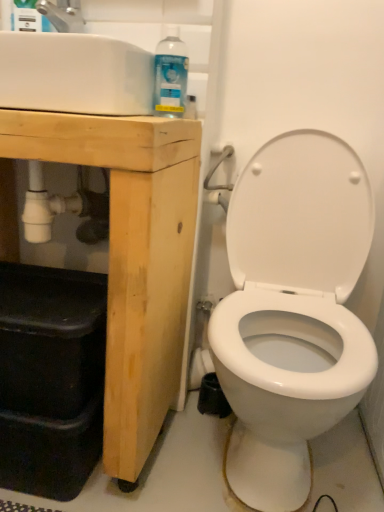
Question: Is natural wood cabinet at left shorter than clear plastic spray bottle at upper left, which appears as the 2th cleaning product when viewed from the right?

Choices:
 (A) no
 (B) yes

Answer: (A)

Question: Does natural wood cabinet at left come behind clear plastic spray bottle at upper left, which ranks as the first cleaning product in top-to-bottom order?

Choices:
 (A) no
 (B) yes

Answer: (A)

Question: Considering the relative sizes of natural wood cabinet at left and clear plastic spray bottle at upper left, the first cleaning product positioned from the left, in the image provided, is natural wood cabinet at left thinner than clear plastic spray bottle at upper left, the first cleaning product positioned from the left,?

Choices:
 (A) no
 (B) yes

Answer: (A)

Question: Considering the relative sizes of natural wood cabinet at left and clear plastic spray bottle at upper left, which appears as the 2th cleaning product when viewed from the right, in the image provided, is natural wood cabinet at left taller than clear plastic spray bottle at upper left, which appears as the 2th cleaning product when viewed from the right,?

Choices:
 (A) yes
 (B) no

Answer: (A)

Question: Can you confirm if natural wood cabinet at left is wider than clear plastic spray bottle at upper left, which ranks as the first cleaning product in top-to-bottom order?

Choices:
 (A) yes
 (B) no

Answer: (A)

Question: From the image's perspective, is natural wood cabinet at left above clear plastic spray bottle at upper left, the first cleaning product positioned from the left?

Choices:
 (A) yes
 (B) no

Answer: (B)

Question: From the image's perspective, would you say clear plastic spray bottle at upper left, the first cleaning product positioned from the left, is shown under clear plastic spray bottle at upper left, positioned as the 2th cleaning product in left-to-right order?

Choices:
 (A) yes
 (B) no

Answer: (B)

Question: Does clear plastic spray bottle at upper left, which ranks as the first cleaning product in top-to-bottom order, have a lesser width compared to clear plastic spray bottle at upper left, marked as the 1th cleaning product in a right-to-left arrangement?

Choices:
 (A) yes
 (B) no

Answer: (A)

Question: From the image's perspective, is clear plastic spray bottle at upper left, which is counted as the second cleaning product, starting from the bottom, located above clear plastic spray bottle at upper left, which appears as the first cleaning product when ordered from the bottom?

Choices:
 (A) no
 (B) yes

Answer: (B)

Question: Considering the relative positions of clear plastic spray bottle at upper left, which is counted as the second cleaning product, starting from the bottom, and clear plastic spray bottle at upper left, marked as the 1th cleaning product in a right-to-left arrangement, in the image provided, is clear plastic spray bottle at upper left, which is counted as the second cleaning product, starting from the bottom, behind clear plastic spray bottle at upper left, marked as the 1th cleaning product in a right-to-left arrangement,?

Choices:
 (A) no
 (B) yes

Answer: (B)

Question: Does clear plastic spray bottle at upper left, which appears as the 2th cleaning product when viewed from the right, have a greater height compared to clear plastic spray bottle at upper left, the second cleaning product positioned from the top?

Choices:
 (A) no
 (B) yes

Answer: (B)

Question: Is clear plastic spray bottle at upper left, marked as the 1th cleaning product in a right-to-left arrangement, completely or partially inside clear plastic spray bottle at upper left, which is counted as the second cleaning product, starting from the bottom?

Choices:
 (A) no
 (B) yes

Answer: (A)

Question: Does white glossy sink at upper left have a lesser width compared to clear plastic spray bottle at upper left, which appears as the 2th cleaning product when viewed from the right?

Choices:
 (A) no
 (B) yes

Answer: (A)